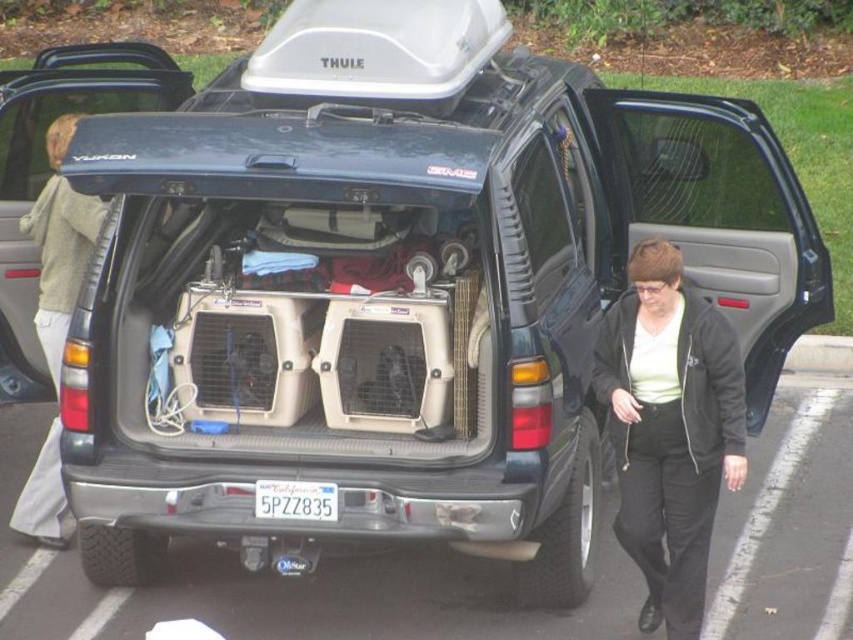
Can you confirm if black rubber parking lot at lower center is taller than black matte jacket at lower right?

No, black rubber parking lot at lower center is not taller than black matte jacket at lower right.

Does black rubber parking lot at lower center have a lesser width compared to black matte jacket at lower right?

Incorrect, black rubber parking lot at lower center's width is not less than black matte jacket at lower right's.

Locate an element on the screen. This screenshot has height=640, width=853. black rubber parking lot at lower center is located at coordinates (328, 600).

Does black rubber parking lot at lower center have a lesser height compared to light brown cotton pants at left?

Indeed, black rubber parking lot at lower center has a lesser height compared to light brown cotton pants at left.

Who is shorter, black rubber parking lot at lower center or light brown cotton pants at left?

Standing shorter between the two is black rubber parking lot at lower center.

Where is `black rubber parking lot at lower center`? black rubber parking lot at lower center is located at coordinates (328, 600).

Does black rubber parking lot at lower center appear over white plastic license plate at center?

No, black rubber parking lot at lower center is not above white plastic license plate at center.

Describe the element at coordinates (328, 600) in the screenshot. I see `black rubber parking lot at lower center` at that location.

You are a GUI agent. You are given a task and a screenshot of the screen. Output one action in this format:
    pyautogui.click(x=<x>, y=<y>)
    Task: Click on the black rubber parking lot at lower center
    
    Given the screenshot: What is the action you would take?
    pyautogui.click(x=328, y=600)